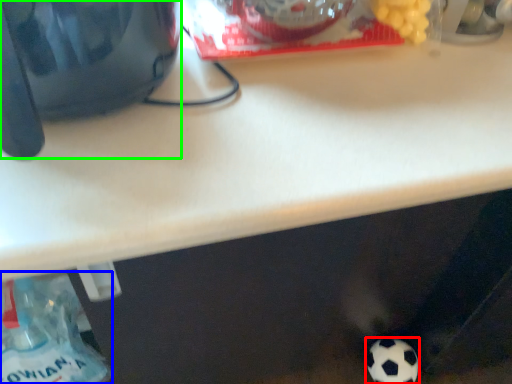
Question: Which object is positioned farthest from football (highlighted by a red box)? Select from bottle (highlighted by a blue box) and appliance (highlighted by a green box).

Choices:
 (A) bottle
 (B) appliance

Answer: (B)